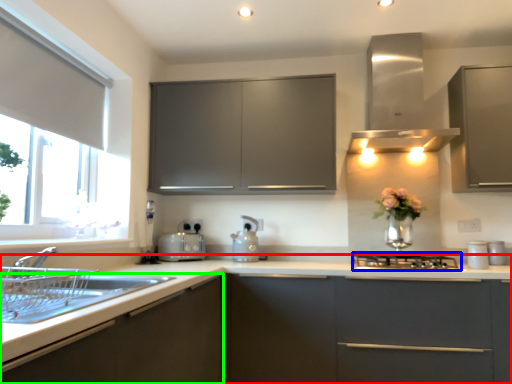
Question: Considering the real-world distances, which object is farthest from countertop (highlighted by a red box)? gas stove (highlighted by a blue box) or cabinetry (highlighted by a green box)?

Choices:
 (A) gas stove
 (B) cabinetry

Answer: (A)